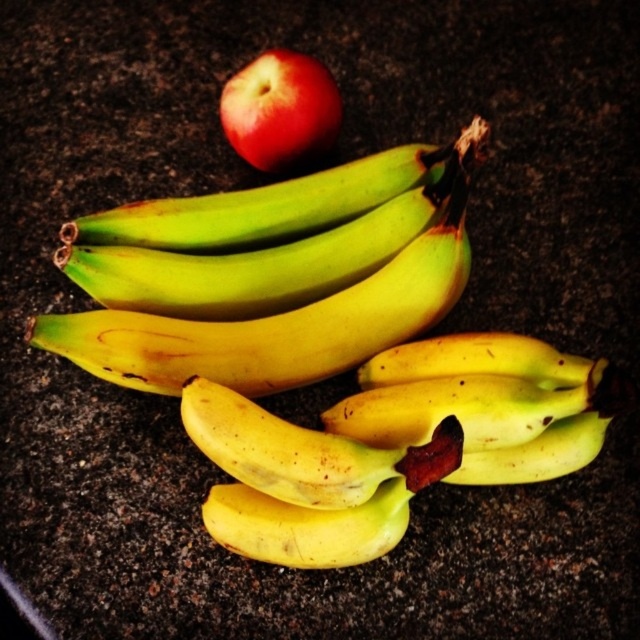
Does yellow matte bananas at center appear over yellow matte banana at center?

Yes, yellow matte bananas at center is above yellow matte banana at center.

Where is `yellow matte bananas at center`? yellow matte bananas at center is located at coordinates (275, 294).

Is yellow matte banana at center to the left of glossy red apple at upper center from the viewer's perspective?

No, yellow matte banana at center is not to the left of glossy red apple at upper center.

Does point (394, 481) come in front of point (224, 115)?

Yes, point (394, 481) is closer to viewer.

Is point (387, 483) positioned behind point (230, 141)?

No.

The image size is (640, 640). Identify the location of yellow matte banana at center. (307, 483).

Does point (420, 305) come behind point (285, 104)?

No, it is not.

Is yellow matte bananas at center below glossy red apple at upper center?

Yes.

Between point (198, 209) and point (314, 67), which one is positioned behind?

The point (314, 67) is more distant.

This screenshot has height=640, width=640. Find the location of `yellow matte bananas at center`. yellow matte bananas at center is located at coordinates (275, 294).